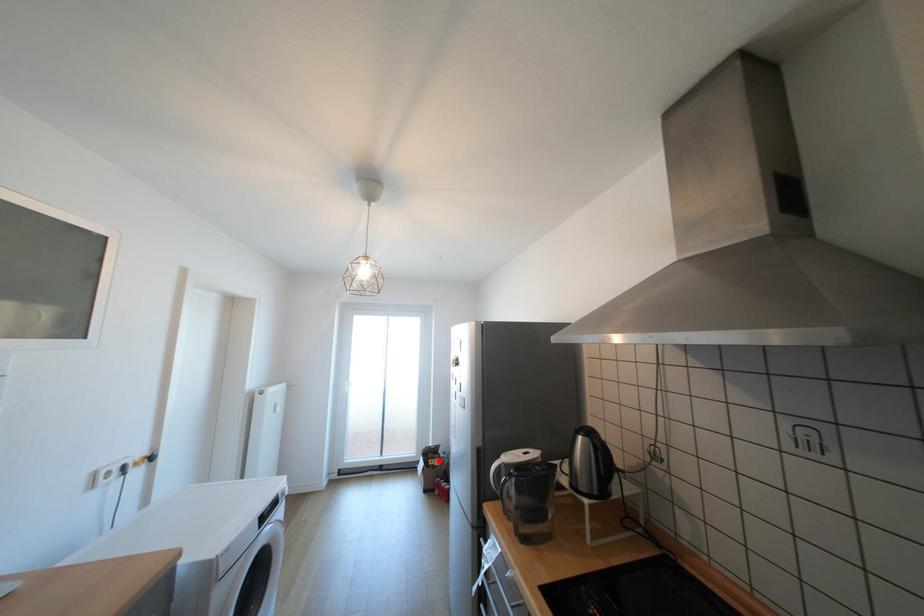
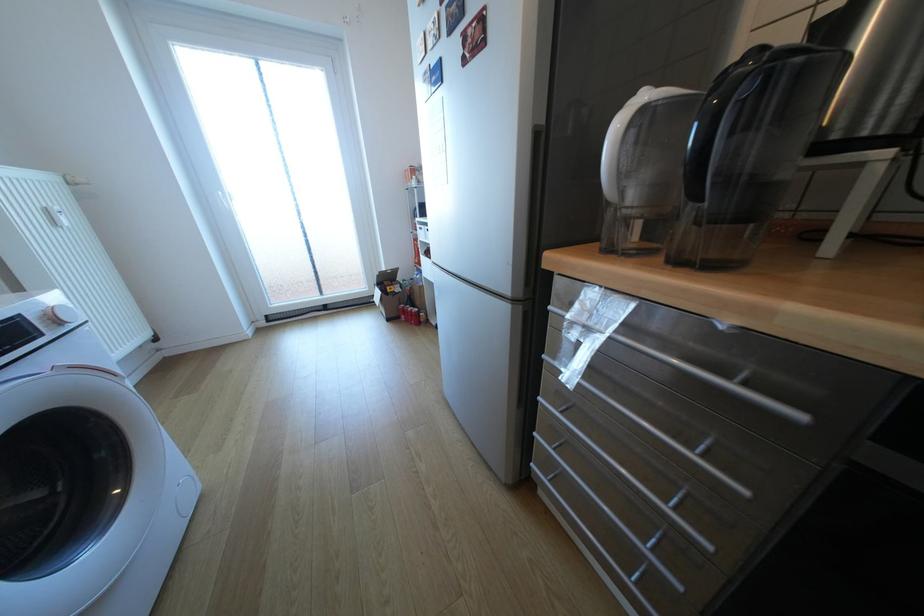
Question: A red point is marked in image1. In image2, is the corresponding 3D point closer to the camera or farther? Reply with the corresponding letter.

Choices:
 (A) The corresponding 3D point is closer.
 (B) The corresponding 3D point is farther.

Answer: (A)